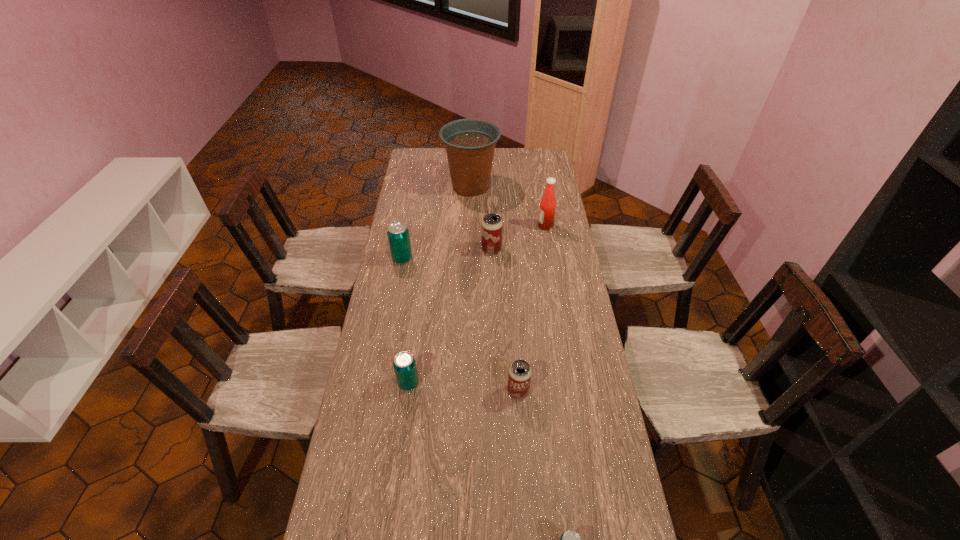
Identify the location of flowerpot. click(470, 143).

Locate an element on the screen. the farthest object is located at coordinates (470, 143).

Where is `condiment`? condiment is located at coordinates (546, 216).

Where is `the rightmost object`? the rightmost object is located at coordinates (546, 216).

Locate an element on the screen. the farther red beer can is located at coordinates (491, 226).

Find the location of a particular element. the biggest teal beer can is located at coordinates (398, 234).

You are a GUI agent. You are given a task and a screenshot of the screen. Output one action in this format:
    pyautogui.click(x=<x>, y=<y>)
    Task: Click on the farthest teal beer can
    
    Given the screenshot: What is the action you would take?
    pyautogui.click(x=398, y=234)

Where is `the smaller red beer can`? the smaller red beer can is located at coordinates (519, 377).

Identify the location of the fourth beer can from right to left. (404, 364).

This screenshot has height=540, width=960. What are the coordinates of `the second biggest teal beer can` in the screenshot? It's located at (404, 364).